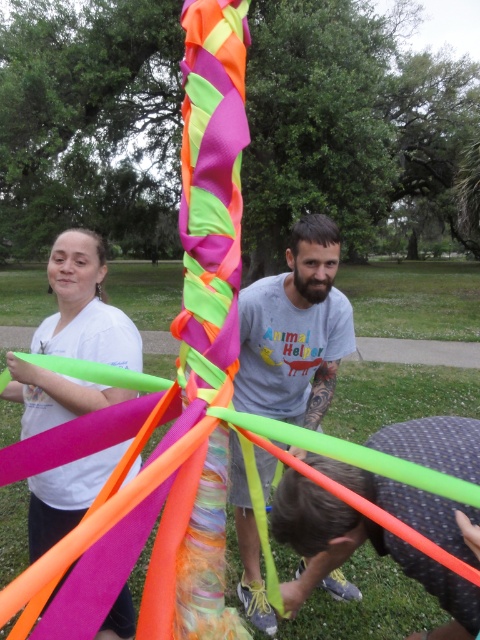
Question: Which object appears farthest from the camera in this image?

Choices:
 (A) neon green plastic hoop at lower center
 (B) neon fabric ribbon at center
 (C) matte white shirt at upper left

Answer: (A)

Question: Which object is closer to the camera taking this photo?

Choices:
 (A) matte white shirt at upper left
 (B) neon fabric ribbon at center
 (C) matte gray t-shirt at center
 (D) neon green plastic hoop at lower center

Answer: (B)

Question: Is neon fabric ribbon at center below matte gray t-shirt at center?

Choices:
 (A) no
 (B) yes

Answer: (A)

Question: Which of the following is the closest to the observer?

Choices:
 (A) neon green plastic hoop at lower center
 (B) neon fabric ribbon at center
 (C) matte white shirt at upper left

Answer: (B)

Question: Is matte gray t-shirt at center in front of neon green plastic hoop at lower center?

Choices:
 (A) no
 (B) yes

Answer: (B)

Question: Where is neon fabric ribbon at center located in relation to matte white shirt at upper left in the image?

Choices:
 (A) above
 (B) below

Answer: (A)